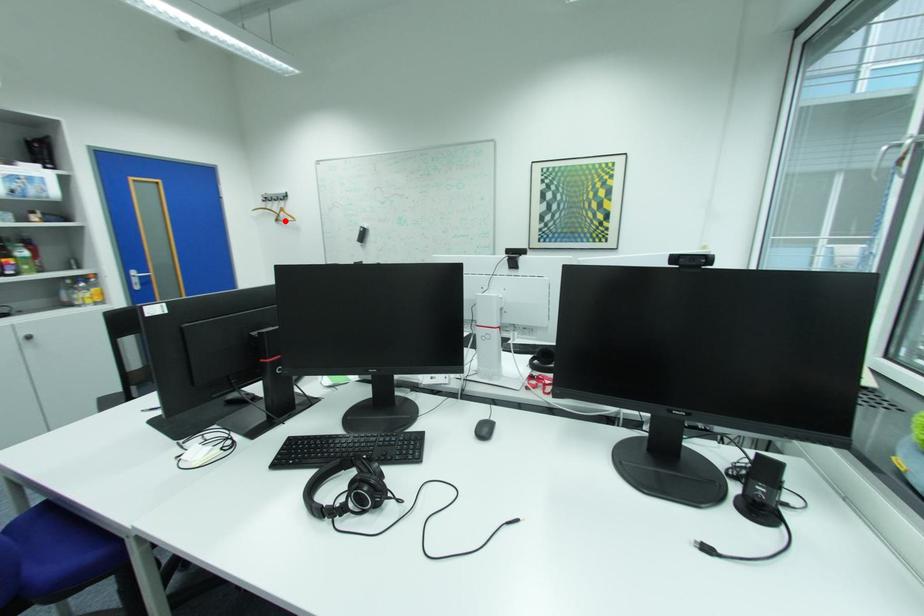
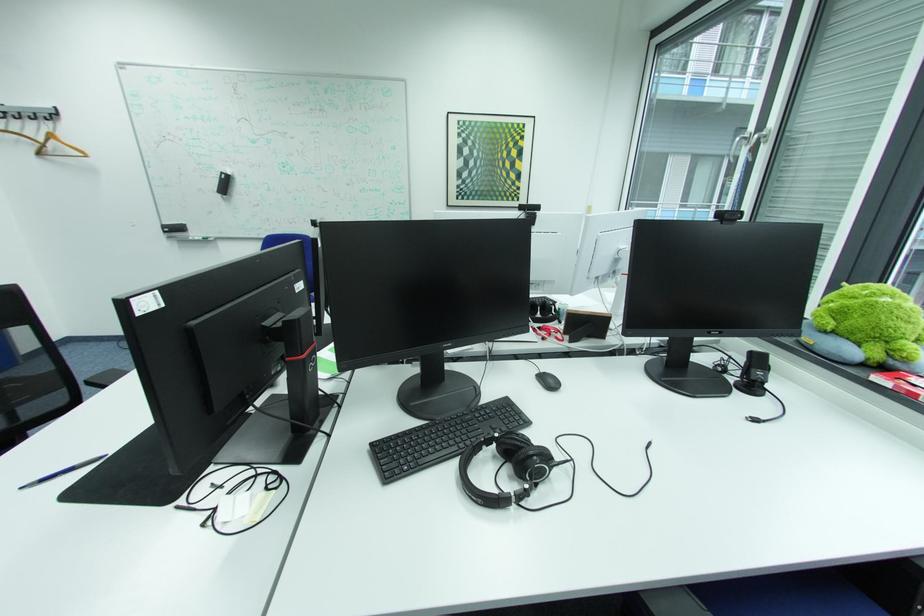
Question: I am providing you with two images of the same scene from different viewpoints. In image1, a red point is highlighted. Considering the same 3D point in image2, which of the following is correct?

Choices:
 (A) It is closer
 (B) It is farther

Answer: (B)